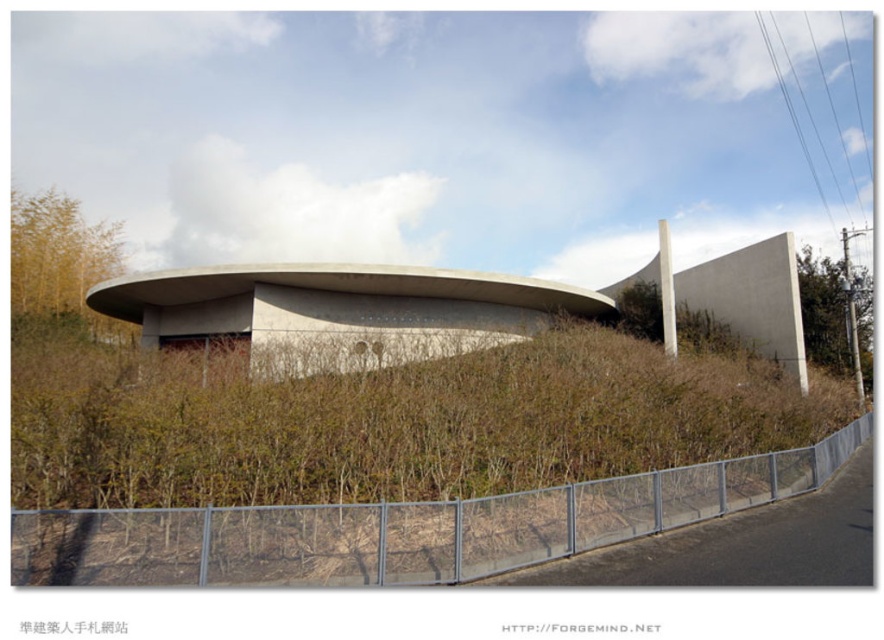
Question: From the image, what is the correct spatial relationship of brown dry grass at center in relation to concrete building at center?

Choices:
 (A) left
 (B) right

Answer: (B)

Question: Which point is closer to the camera taking this photo?

Choices:
 (A) (105, 284)
 (B) (296, 452)

Answer: (B)

Question: Which point is farther from the camera taking this photo?

Choices:
 (A) (174, 288)
 (B) (566, 545)

Answer: (A)

Question: Where is brown dry grass at center located in relation to concrete building at center in the image?

Choices:
 (A) above
 (B) below

Answer: (B)

Question: Which point appears closest to the camera in this image?

Choices:
 (A) (669, 481)
 (B) (193, 317)

Answer: (A)

Question: Is brown dry grass at center bigger than concrete building at center?

Choices:
 (A) yes
 (B) no

Answer: (B)